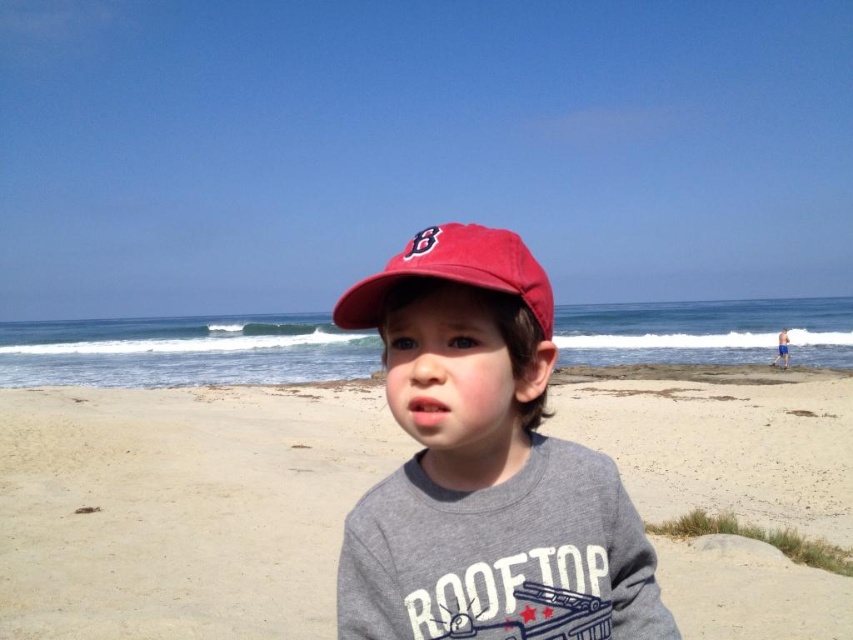
In the scene, there is a point marked at coordinates [181,508]. Based on the description, what is the location of this point in relation to the beige sand at center?

The point [181,508] is located on the beige sand at center.

You are a photographer trying to capture the child in the image. If you want to focus on the matte red cap at center while keeping the beige sand at center in the background, which object should be closer to the camera?

The matte red cap at center should be closer to the camera than the beige sand at center because the beige sand at center is further away from the viewer.

You are a photographer trying to capture a wide shot of the scene. The beige sand at center and the matte red baseball cap at center are both in the frame. Which object occupies more horizontal space in the photo?

The beige sand at center occupies more horizontal space in the photo because its width surpasses that of the matte red baseball cap at center as stated in the description.